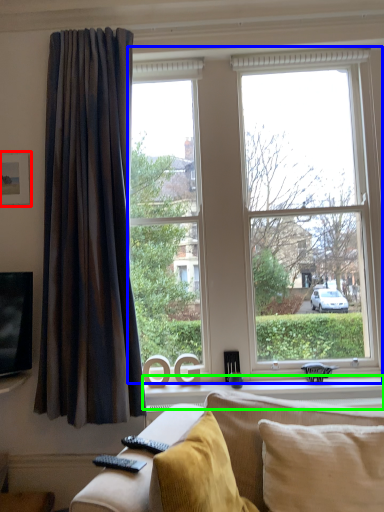
Question: Which object is the farthest from picture frame (highlighted by a red box)? Choose among these: window (highlighted by a blue box) or window sill (highlighted by a green box).

Choices:
 (A) window
 (B) window sill

Answer: (B)